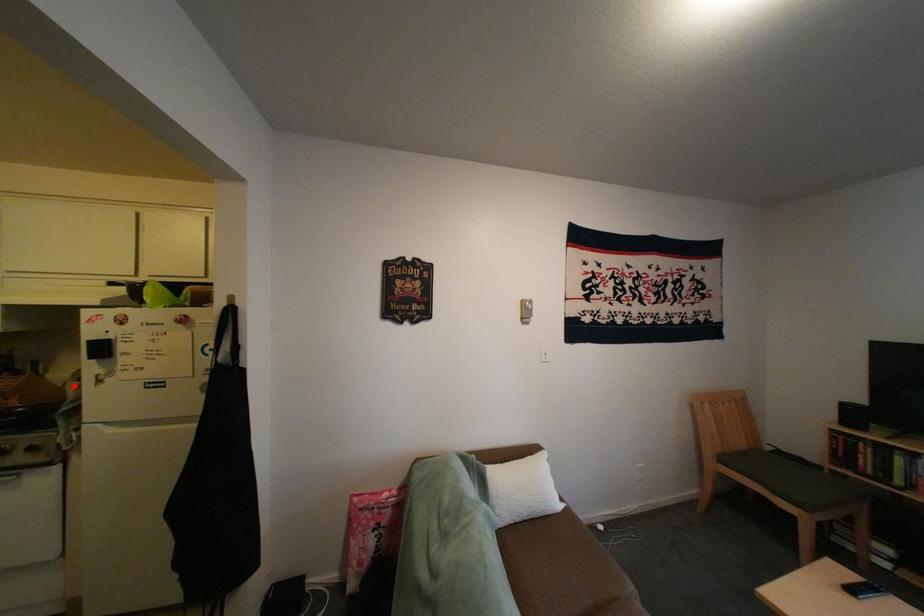
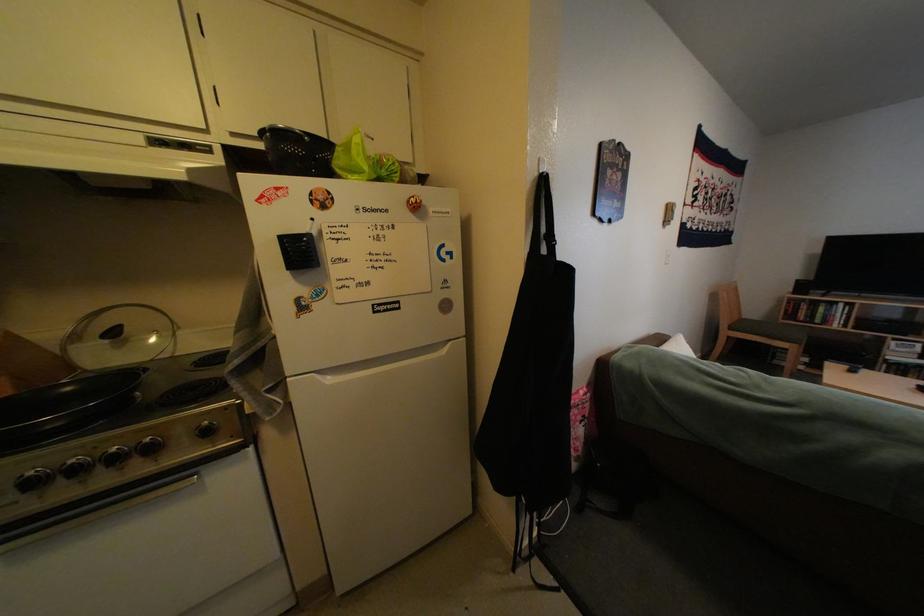
Locate, in the second image, the point that corresponds to the highlighted location in the first image.

(71, 353)